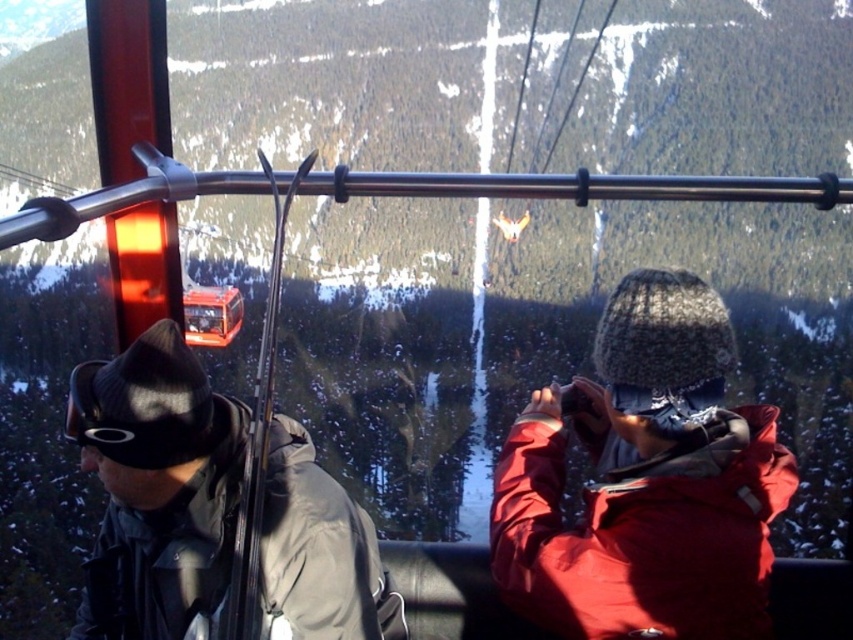
Based on the photo, measure the distance between matte black jacket at left and camera.

matte black jacket at left and camera are 56.24 feet apart.

Is point (181, 458) farther from viewer compared to point (364, 554)?

No, it is in front of (364, 554).

Where is `matte black jacket at left`? matte black jacket at left is located at coordinates (645, 481).